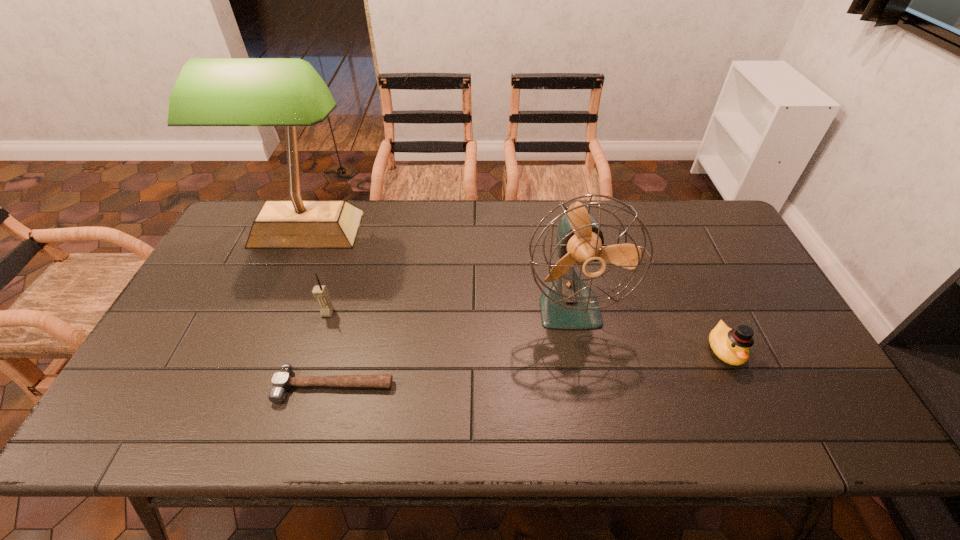
Locate an element on the screen. This screenshot has width=960, height=540. vacant space at the near right corner of the desktop is located at coordinates (835, 428).

Locate an element on the screen. The width and height of the screenshot is (960, 540). free space between the fourth shortest object and the rightmost object is located at coordinates (647, 328).

Identify the location of empty location between the fourth object from left to right and the cellular telephone. (449, 309).

Identify the location of free area in between the fourth tallest object and the fourth shortest object. (647, 328).

I want to click on vacant area that lies between the fan and the shortest object, so click(x=452, y=346).

The height and width of the screenshot is (540, 960). Find the location of `vacant region between the hammer and the fourth shortest object`. vacant region between the hammer and the fourth shortest object is located at coordinates (452, 346).

Where is `vacant area between the hammer and the third tallest object`? vacant area between the hammer and the third tallest object is located at coordinates (331, 349).

The height and width of the screenshot is (540, 960). What are the coordinates of `vacant point located between the fan and the rightmost object` in the screenshot? It's located at (647, 328).

This screenshot has height=540, width=960. I want to click on vacant space that is in between the tallest object and the cellular telephone, so click(x=318, y=271).

Find the location of a particular element. the closest object relative to the table lamp is located at coordinates (320, 292).